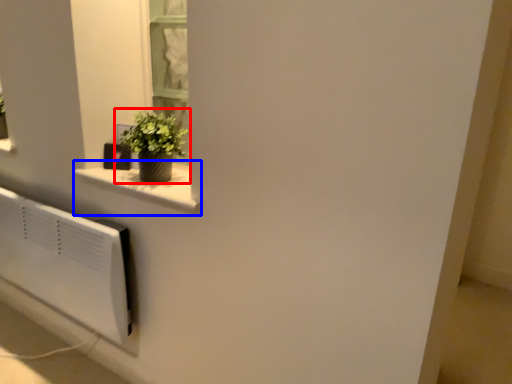
Question: Which point is closer to the camera, houseplant (highlighted by a red box) or window sill (highlighted by a blue box)?

Choices:
 (A) houseplant
 (B) window sill

Answer: (B)